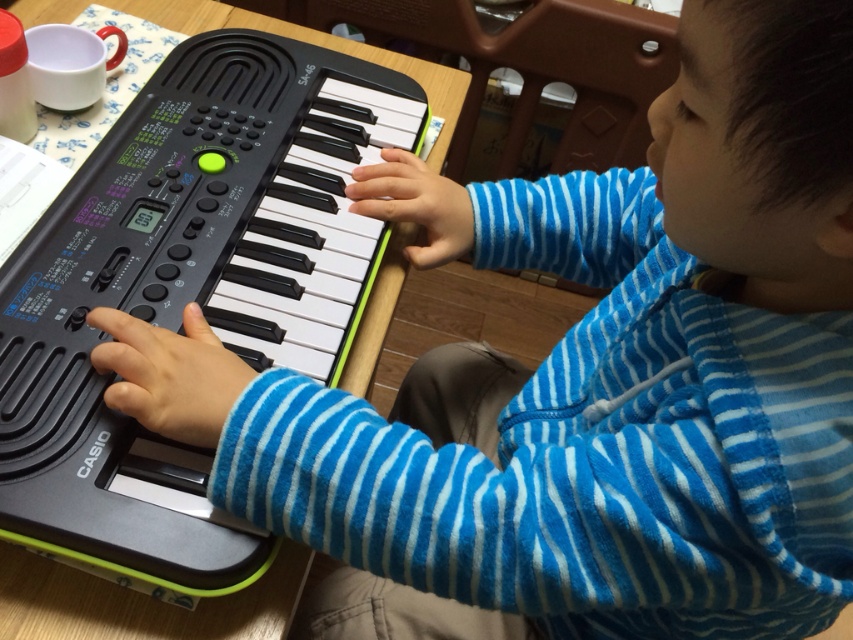
Is black plastic keyboard at center positioned behind black matte keyboard key at center?

No, black plastic keyboard at center is in front of black matte keyboard key at center.

Who is positioned more to the left, black plastic keyboard at center or black matte keyboard key at center?

Positioned to the left is black matte keyboard key at center.

Who is more distant from viewer, (225, 561) or (105, 320)?

The point (105, 320) is more distant.

This screenshot has width=853, height=640. I want to click on black plastic keyboard at center, so click(189, 288).

What do you see at coordinates (169, 374) in the screenshot? I see `black matte keyboard key at center` at bounding box center [169, 374].

Which is below, black matte keyboard key at center or black matte keyboard keys at center?

black matte keyboard key at center

Is point (218, 388) farther from camera compared to point (370, 186)?

That is False.

Where is `black matte keyboard key at center`? This screenshot has height=640, width=853. black matte keyboard key at center is located at coordinates (169, 374).

Is black plastic keyboard at center to the right of black matte keyboard keys at center from the viewer's perspective?

Incorrect, black plastic keyboard at center is not on the right side of black matte keyboard keys at center.

Does black plastic keyboard at center have a smaller size compared to black matte keyboard keys at center?

Incorrect, black plastic keyboard at center is not smaller in size than black matte keyboard keys at center.

Between point (102, 284) and point (469, 198), which one is positioned in front?

Point (102, 284) is more forward.

This screenshot has height=640, width=853. Find the location of `black plastic keyboard at center`. black plastic keyboard at center is located at coordinates (189, 288).